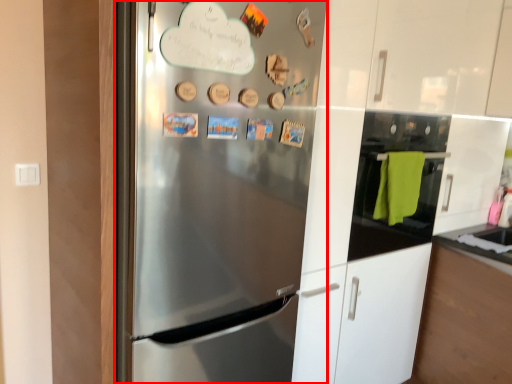
Question: From the image's perspective, where is refrigerator (annotated by the red box) located in relation to oven in the image?

Choices:
 (A) below
 (B) above

Answer: (A)